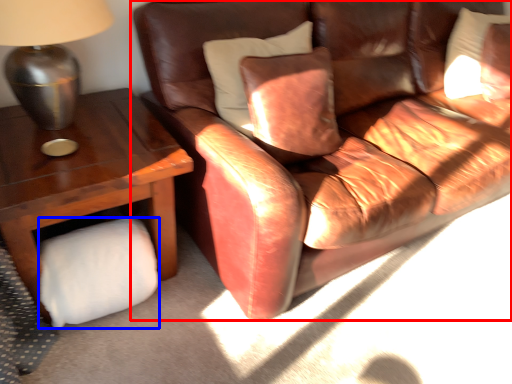
Question: Which object appears farthest to the camera in this image, studio couch (highlighted by a red box) or toilet paper (highlighted by a blue box)?

Choices:
 (A) studio couch
 (B) toilet paper

Answer: (B)